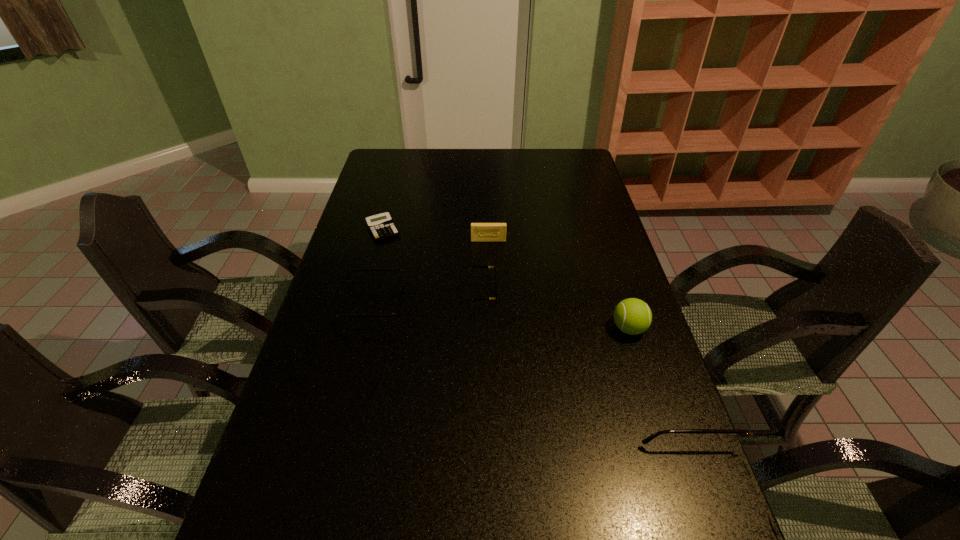
Identify the location of the leftmost spectacles. This screenshot has height=540, width=960. (396, 313).

Locate an element on the screen. The image size is (960, 540). videotape is located at coordinates (480, 232).

Where is `tennis ball`? tennis ball is located at coordinates [x=632, y=316].

This screenshot has height=540, width=960. I want to click on calculator, so click(x=381, y=226).

The height and width of the screenshot is (540, 960). I want to click on the second spectacles from left to right, so click(494, 267).

This screenshot has height=540, width=960. Identify the location of the fifth tallest object. (494, 267).

You are a GUI agent. You are given a task and a screenshot of the screen. Output one action in this format:
    pyautogui.click(x=<x>, y=<y>)
    Task: Click on the vacant space located at the hinge ends of the leftmost spectacles
    This screenshot has width=960, height=540.
    Given the screenshot: What is the action you would take?
    pyautogui.click(x=514, y=305)

The width and height of the screenshot is (960, 540). I want to click on free space located at the front of the videotape with spools, so click(x=490, y=273).

You are a GUI agent. You are given a task and a screenshot of the screen. Output one action in this format:
    pyautogui.click(x=<x>, y=<y>)
    Task: Click on the vacant space located on the back of the tallest object
    
    Given the screenshot: What is the action you would take?
    pyautogui.click(x=601, y=241)

Find the location of a particular element. This screenshot has width=960, height=540. vacant space located on the back of the shortest object is located at coordinates (398, 171).